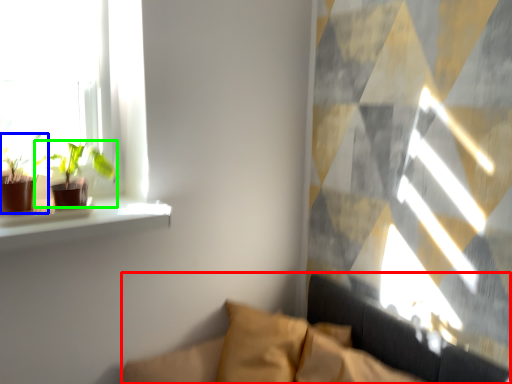
Question: Estimate the real-world distances between objects in this image. Which object is closer to couch (highlighted by a red box), houseplant (highlighted by a blue box) or houseplant (highlighted by a green box)?

Choices:
 (A) houseplant
 (B) houseplant

Answer: (B)